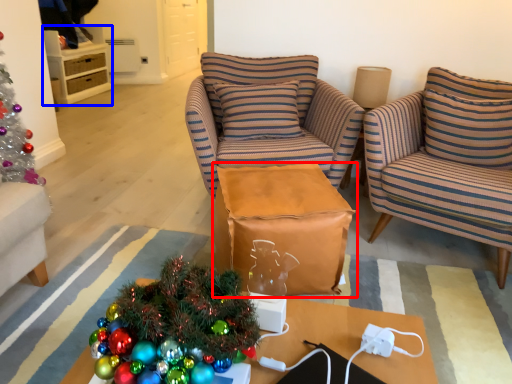
Question: Which point is further to the camera, table (highlighted by a red box) or cabinetry (highlighted by a blue box)?

Choices:
 (A) table
 (B) cabinetry

Answer: (B)